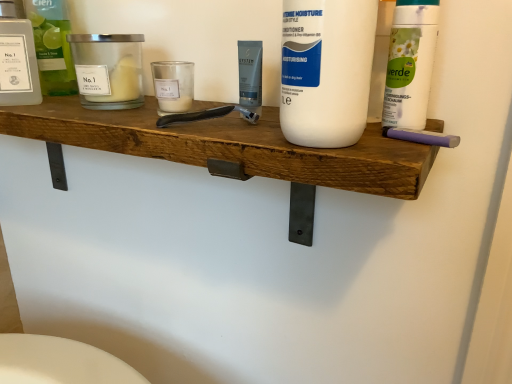
Question: Is matte glass candle at left, the second personal care from the right, taller than wooden shelf at center?

Choices:
 (A) yes
 (B) no

Answer: (B)

Question: Is matte glass candle at left, which is the 2th personal care from left to right, smaller than wooden shelf at center?

Choices:
 (A) no
 (B) yes

Answer: (B)

Question: Is matte glass candle at left, which is the 2th personal care from left to right, far from wooden shelf at center?

Choices:
 (A) no
 (B) yes

Answer: (A)

Question: From the image's perspective, would you say matte glass candle at left, the second personal care from the right, is shown under wooden shelf at center?

Choices:
 (A) yes
 (B) no

Answer: (B)

Question: Is matte glass candle at left, the second personal care from the right, thinner than wooden shelf at center?

Choices:
 (A) yes
 (B) no

Answer: (A)

Question: In terms of width, does translucent glass bottle at upper left, which is counted as the 3th cleaning product, starting from the right, look wider or thinner when compared to white matte bottle at upper right, which is the first cleaning product in right-to-left order?

Choices:
 (A) thin
 (B) wide

Answer: (A)

Question: In terms of height, does translucent glass bottle at upper left, placed as the third cleaning product when sorted from front to back, look taller or shorter compared to white matte bottle at upper right, the third cleaning product in the left-to-right sequence?

Choices:
 (A) tall
 (B) short

Answer: (A)

Question: From the image's perspective, is translucent glass bottle at upper left, placed as the third cleaning product when sorted from front to back, located above or below white matte bottle at upper right, which ranks as the 2th cleaning product in front-to-back order?

Choices:
 (A) below
 (B) above

Answer: (B)

Question: Considering the positions of translucent glass bottle at upper left, which is counted as the 3th cleaning product, starting from the right, and white matte bottle at upper right, the second cleaning product viewed from the back, in the image, is translucent glass bottle at upper left, which is counted as the 3th cleaning product, starting from the right, bigger or smaller than white matte bottle at upper right, the second cleaning product viewed from the back,?

Choices:
 (A) big
 (B) small

Answer: (A)

Question: Is point (59, 48) positioned closer to the camera than point (360, 97)?

Choices:
 (A) closer
 (B) farther

Answer: (B)

Question: In the image, is translucent glass bottle at upper left, which appears as the 1th cleaning product when viewed from the left, positioned in front of or behind white matte bottle at center, which is the second cleaning product in right-to-left order?

Choices:
 (A) behind
 (B) front

Answer: (A)

Question: Considering the relative positions of translucent glass bottle at upper left, which is counted as the 3th cleaning product, starting from the right, and white matte bottle at center, the second cleaning product viewed from the left, in the image provided, is translucent glass bottle at upper left, which is counted as the 3th cleaning product, starting from the right, to the left or to the right of white matte bottle at center, the second cleaning product viewed from the left,?

Choices:
 (A) left
 (B) right

Answer: (A)

Question: From a real-world perspective, is translucent glass bottle at upper left, arranged as the first cleaning product when viewed from the back, positioned above or below white matte bottle at center, marked as the 3th cleaning product in a back-to-front arrangement?

Choices:
 (A) below
 (B) above

Answer: (A)

Question: Is translucent glass bottle at upper left, which appears as the 1th cleaning product when viewed from the left, bigger or smaller than wooden shelf at center?

Choices:
 (A) small
 (B) big

Answer: (A)

Question: In the image, is translucent glass bottle at upper left, placed as the third cleaning product when sorted from front to back, positioned in front of or behind wooden shelf at center?

Choices:
 (A) front
 (B) behind

Answer: (B)